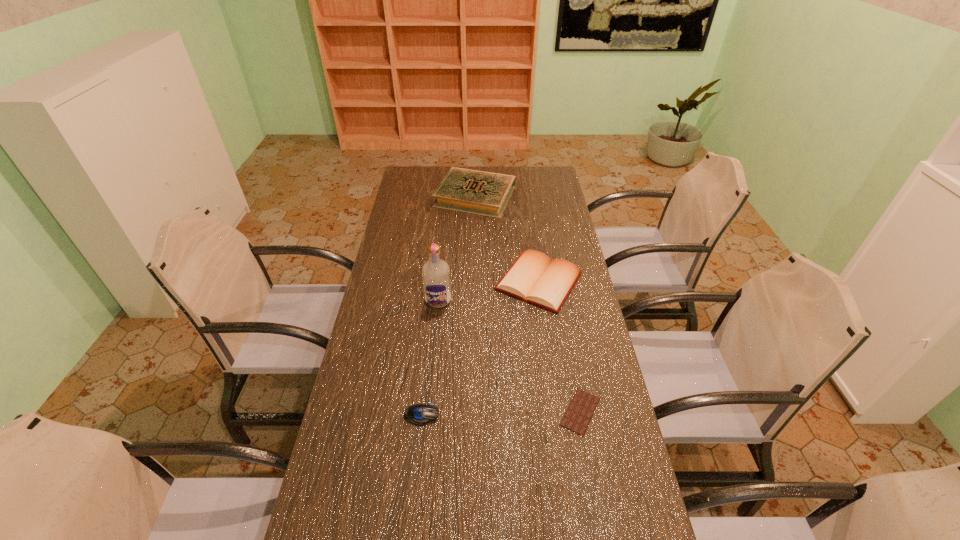
At what (x,y) coordinates should I click in order to perform the action: click on free location located on the back of the shortest object. Please return your answer as a coordinate pair (x, y). The width and height of the screenshot is (960, 540). Looking at the image, I should click on (560, 301).

Locate an element on the screen. This screenshot has height=540, width=960. object at the far edge is located at coordinates (485, 193).

This screenshot has height=540, width=960. I want to click on Bible present at the right edge, so click(x=535, y=278).

The width and height of the screenshot is (960, 540). What are the coordinates of `chocolate bar situated at the right edge` in the screenshot? It's located at (581, 409).

Find the location of a particular element. blank space at the left edge of the desktop is located at coordinates (396, 242).

The width and height of the screenshot is (960, 540). In order to click on free space at the right edge of the desktop in this screenshot , I will do `click(535, 213)`.

Identify the location of free space at the far left corner. This screenshot has width=960, height=540. (429, 172).

The width and height of the screenshot is (960, 540). I want to click on free space between the fourth tallest object and the vodka, so click(430, 357).

I want to click on vacant region between the shortest object and the third shortest object, so click(x=560, y=346).

You are a GUI agent. You are given a task and a screenshot of the screen. Output one action in this format:
    pyautogui.click(x=<x>, y=<y>)
    Task: Click on the free spot between the computer mouse and the Bible
    
    Given the screenshot: What is the action you would take?
    pyautogui.click(x=480, y=348)